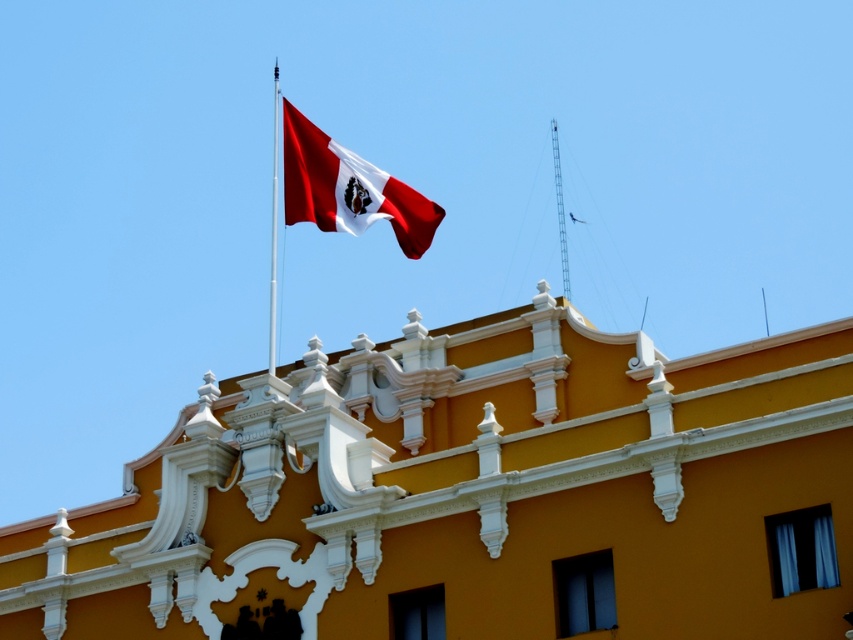
You are a construction worker planning to install a new light pole between the metallic flag pole at upper center and the metallic tower at upper center. The light pole requires a minimum of 70 feet of space between the existing structures to be safely installed. Based on the distance provided, is this installation feasible?

The metallic flag pole at upper center is 69.45 feet from the metallic tower at upper center. Since the required minimum distance is 70 feet, the installation is not feasible as the existing structures are too close.

You are a photographer wanting to capture both the metallic flag pole at upper center and the metallic tower at upper center in the same frame. Based on their sizes, which one should you focus on to ensure both fit well in the photo?

The metallic flag pole at upper center is bigger than the metallic tower at upper center, so you should focus on the metallic tower at upper center to ensure both fit well in the photo.